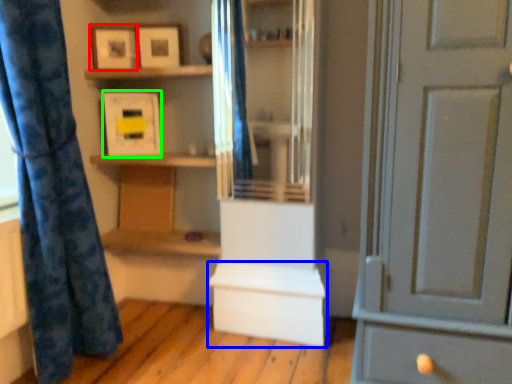
Question: Which object is the farthest from picture frame (highlighted by a red box)? Choose among these: cabinetry (highlighted by a blue box) or picture frame (highlighted by a green box).

Choices:
 (A) cabinetry
 (B) picture frame

Answer: (A)